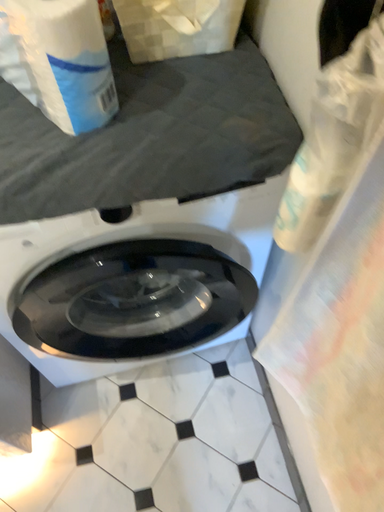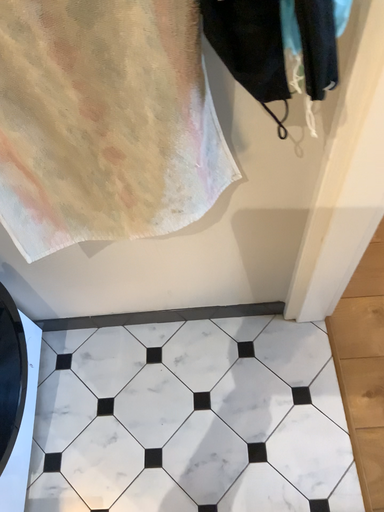
Question: How did the camera likely rotate when shooting the video?

Choices:
 (A) rotated left
 (B) rotated right

Answer: (B)